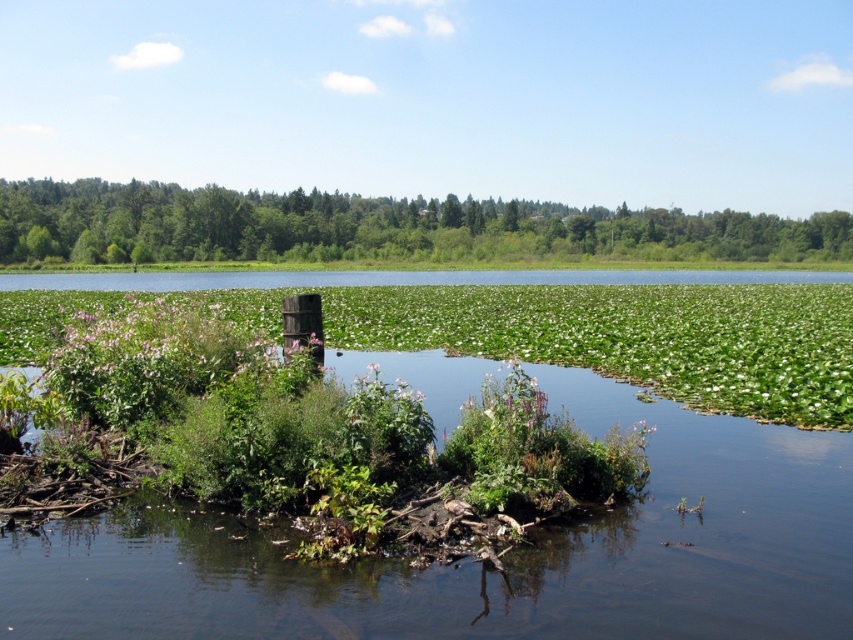
Who is lower down, green leafy plant at center or green leafy tree at upper center?

green leafy plant at center is below.

Does point (375, 289) come behind point (138, 186)?

No, (375, 289) is closer to viewer.

Image resolution: width=853 pixels, height=640 pixels. I want to click on green leafy plant at center, so coord(634,337).

The width and height of the screenshot is (853, 640). I want to click on green leafy plant at center, so click(634, 337).